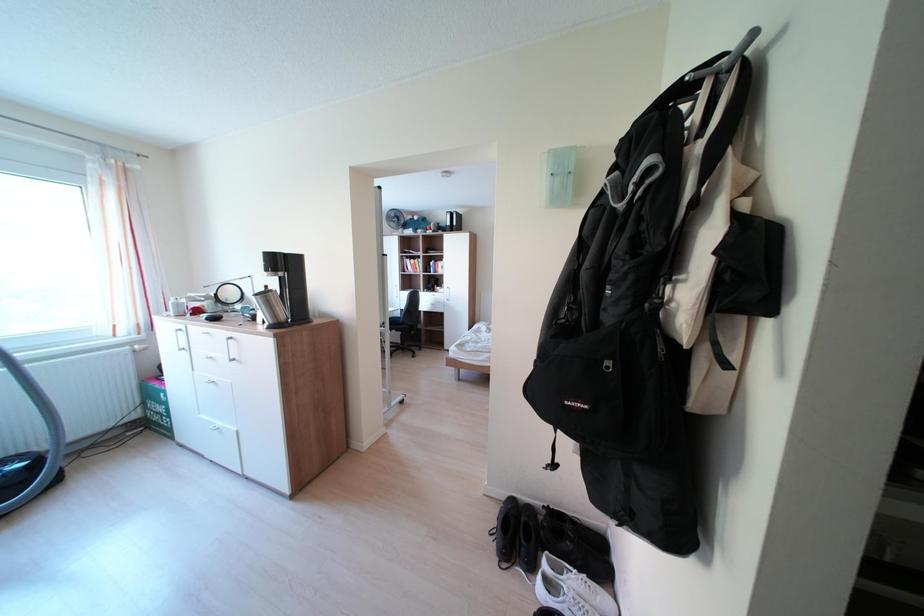
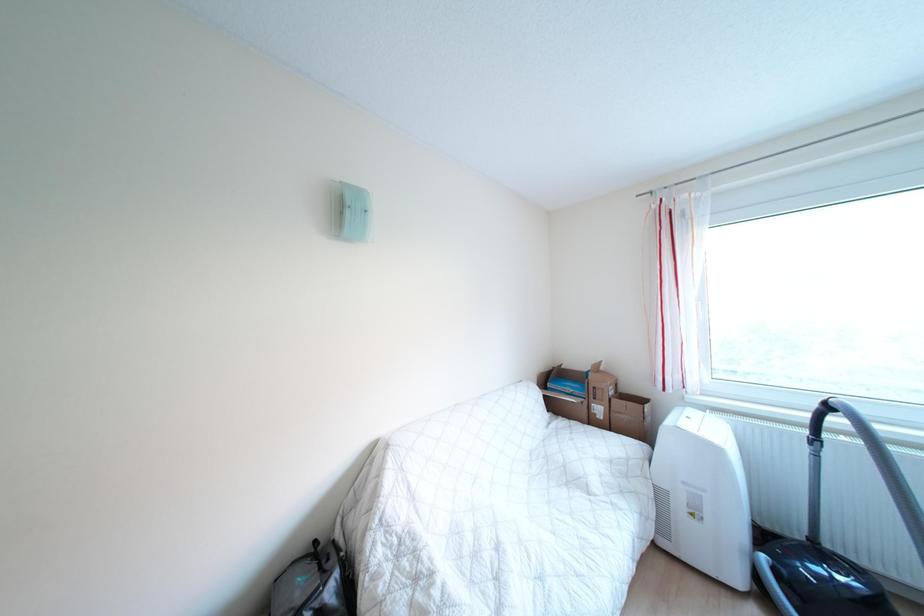
Question: The first image is from the beginning of the video and the second image is from the end. How did the camera likely rotate when shooting the video?

Choices:
 (A) Left
 (B) Right
 (C) Up
 (D) Down

Answer: (A)